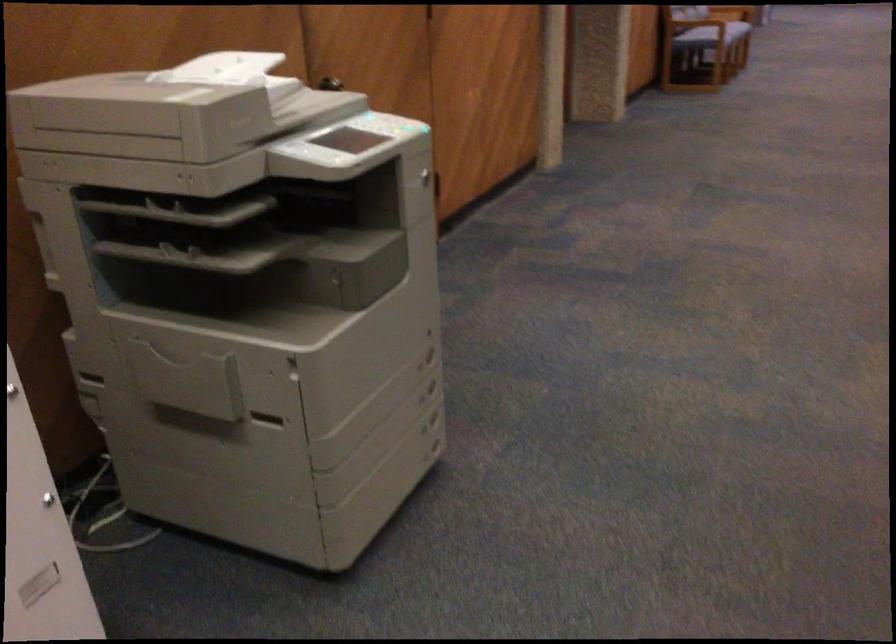
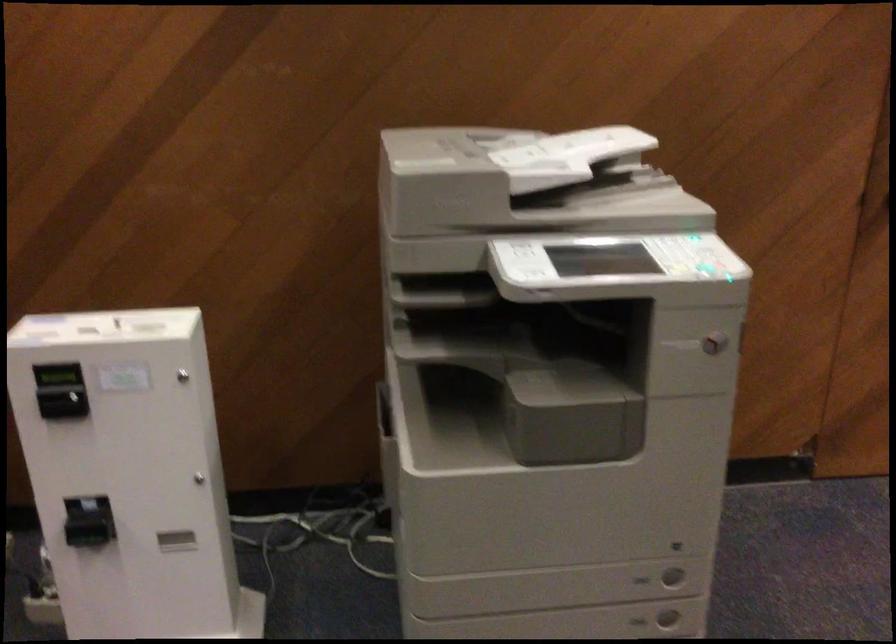
Question: I am providing you with two images of the same scene from different viewpoints. After the viewpoint changes to image2, which objects are now occluded?

Choices:
 (A) printer drawer handle
 (B) printer control buttons
 (C) scanner lid
 (D) none of these

Answer: (D)